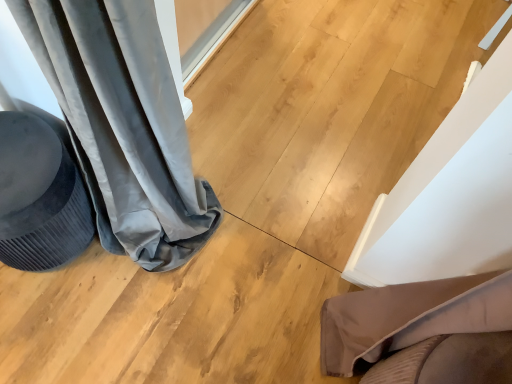
Question: Can you confirm if velvet dark gray swivel chair at left is shorter than brown fabric cushion at lower right?

Choices:
 (A) no
 (B) yes

Answer: (B)

Question: Does velvet dark gray swivel chair at left come in front of brown fabric cushion at lower right?

Choices:
 (A) yes
 (B) no

Answer: (B)

Question: Does velvet dark gray swivel chair at left have a lesser width compared to brown fabric cushion at lower right?

Choices:
 (A) yes
 (B) no

Answer: (B)

Question: Is velvet dark gray swivel chair at left aimed at brown fabric cushion at lower right?

Choices:
 (A) no
 (B) yes

Answer: (A)

Question: From the image's perspective, is velvet dark gray swivel chair at left below brown fabric cushion at lower right?

Choices:
 (A) yes
 (B) no

Answer: (B)

Question: Is velvet dark gray swivel chair at left not close to brown fabric cushion at lower right?

Choices:
 (A) no
 (B) yes

Answer: (A)

Question: Does brown fabric cushion at lower right have a greater height compared to velvet dark gray swivel chair at left?

Choices:
 (A) yes
 (B) no

Answer: (A)

Question: Is brown fabric cushion at lower right positioned before velvet dark gray swivel chair at left?

Choices:
 (A) no
 (B) yes

Answer: (B)

Question: Is brown fabric cushion at lower right facing away from velvet dark gray swivel chair at left?

Choices:
 (A) yes
 (B) no

Answer: (B)

Question: Is brown fabric cushion at lower right behind velvet dark gray swivel chair at left?

Choices:
 (A) no
 (B) yes

Answer: (A)

Question: Does brown fabric cushion at lower right have a lesser height compared to velvet dark gray swivel chair at left?

Choices:
 (A) yes
 (B) no

Answer: (B)

Question: Is brown fabric cushion at lower right positioned beyond the bounds of velvet dark gray swivel chair at left?

Choices:
 (A) no
 (B) yes

Answer: (B)

Question: Is brown fabric cushion at lower right situated inside velvet dark gray swivel chair at left or outside?

Choices:
 (A) outside
 (B) inside

Answer: (A)